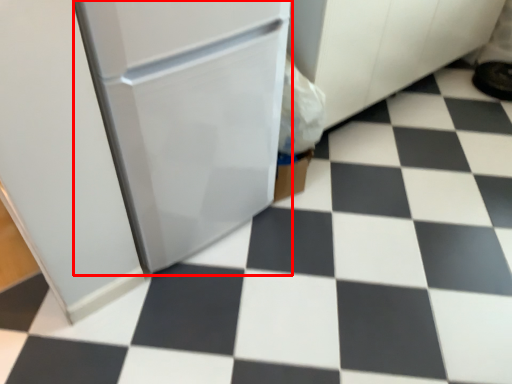
Question: From the image's perspective, what is the correct spatial relationship of appliance (annotated by the red box) in relation to footwear?

Choices:
 (A) above
 (B) below

Answer: (B)